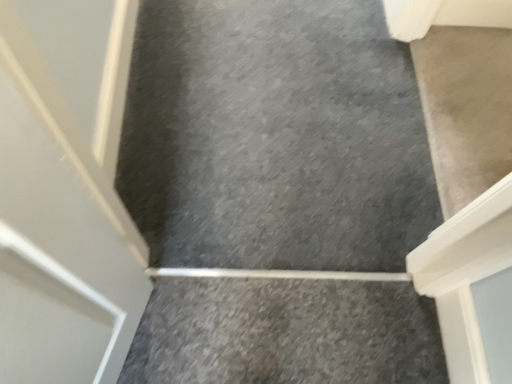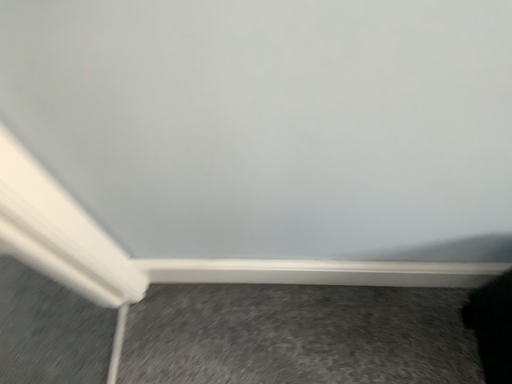
Question: How did the camera likely rotate when shooting the video?

Choices:
 (A) rotated upward
 (B) rotated downward

Answer: (A)